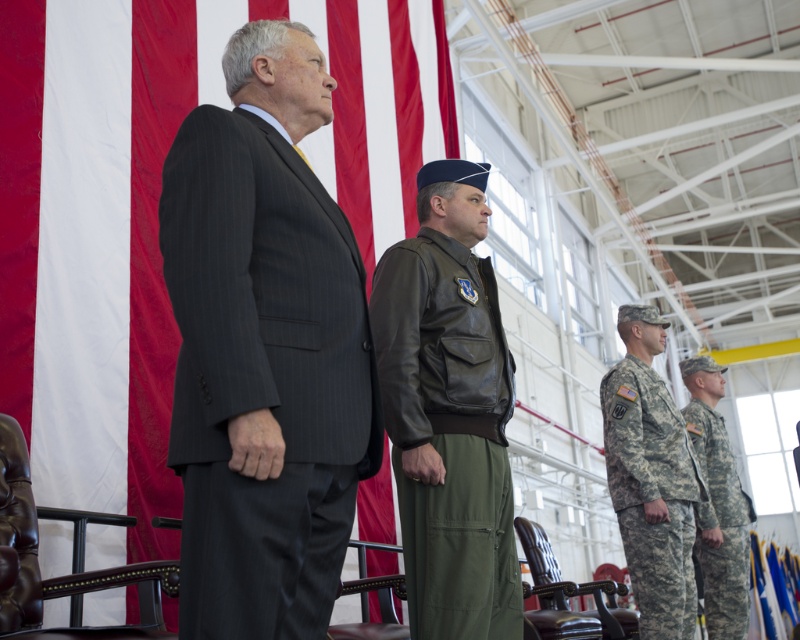
Question: Estimate the real-world distances between objects in this image. Which object is closer to the camouflage uniform at right?

Choices:
 (A) camouflage fabric uniform at right
 (B) red/white fabric flag at upper left
 (C) dark gray pinstripe suit at center

Answer: (A)

Question: Can you confirm if red/white fabric flag at upper left is smaller than camouflage uniform at right?

Choices:
 (A) no
 (B) yes

Answer: (A)

Question: Does leather jacket at center have a larger size compared to camouflage fabric uniform at right?

Choices:
 (A) no
 (B) yes

Answer: (A)

Question: Is red/white fabric flag at upper left positioned behind leather jacket at center?

Choices:
 (A) yes
 (B) no

Answer: (A)

Question: Which of the following is the farthest from the observer?

Choices:
 (A) dark gray pinstripe suit at center
 (B) camouflage uniform at right

Answer: (B)

Question: Which point is farther from the camera taking this photo?

Choices:
 (A) (486, 332)
 (B) (352, 196)

Answer: (B)